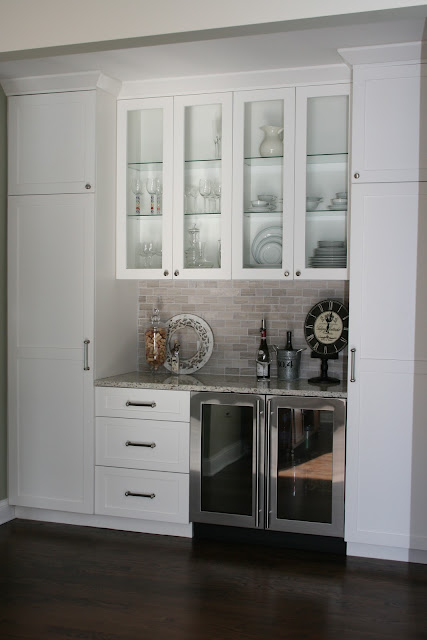
Locate an element on the screen. The height and width of the screenshot is (640, 427). ceiling is located at coordinates (236, 22).